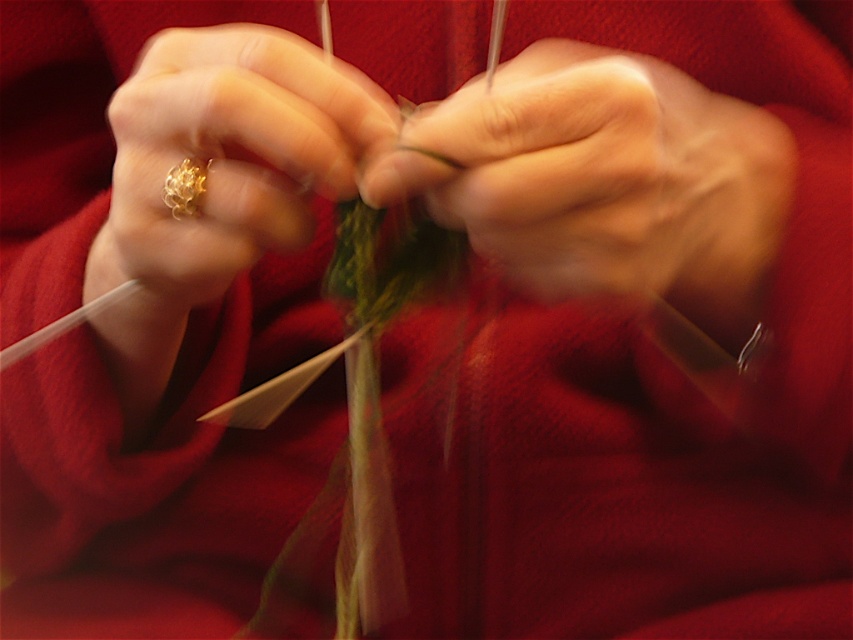
Which is in front, point (759, 195) or point (114, 259)?

Point (114, 259) is more forward.

Looking at this image, can you confirm if green yarn at center is smaller than gold textured ring at center?

Yes, green yarn at center is smaller than gold textured ring at center.

Is point (376, 179) positioned behind point (337, 99)?

No, (376, 179) is in front of (337, 99).

The height and width of the screenshot is (640, 853). I want to click on green yarn at center, so click(602, 179).